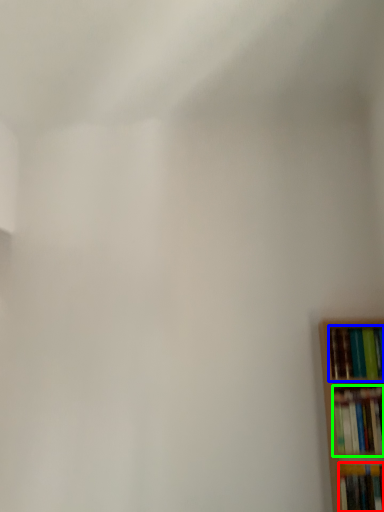
Question: Based on their relative distances, which object is farther from book (highlighted by a red box)? Choose from book (highlighted by a blue box) and book (highlighted by a green box).

Choices:
 (A) book
 (B) book

Answer: (A)